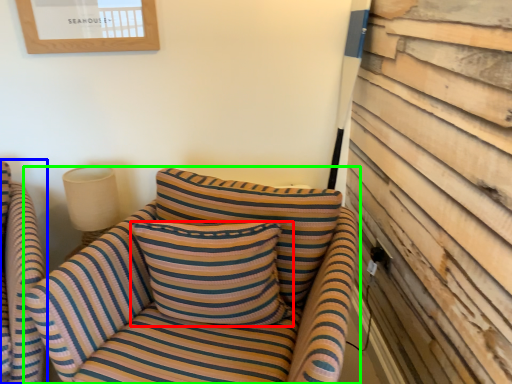
Question: Which object is positioned farthest from pillow (highlighted by a red box)? Select from chair (highlighted by a blue box) and studio couch (highlighted by a green box).

Choices:
 (A) chair
 (B) studio couch

Answer: (A)